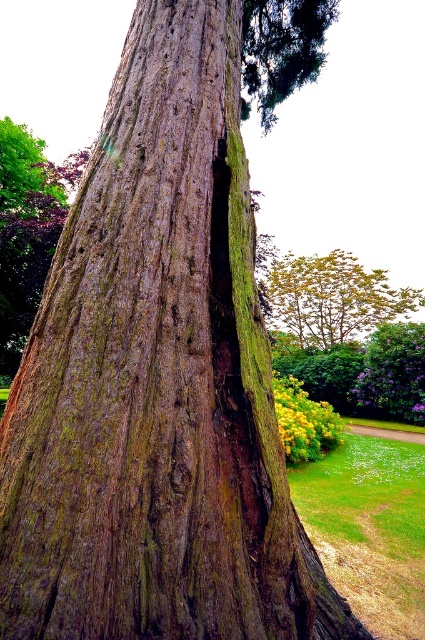
Is yellow-green textured tree trunk at upper right wider than green mossy bark at upper center?

No.

Between point (357, 298) and point (274, 113), which one is positioned in front?

Point (274, 113)

This screenshot has width=425, height=640. I want to click on yellow-green textured tree trunk at upper right, so click(x=334, y=298).

Is green mossy bark at upper center above green mossy tree trunk at center?

Yes.

Between point (302, 13) and point (424, 358), which one is positioned in front?

Point (302, 13) is in front.

I want to click on green mossy bark at upper center, so click(280, 49).

Where is `green mossy bark at upper center`? This screenshot has width=425, height=640. green mossy bark at upper center is located at coordinates (280, 49).

Does yellow-green textured tree trunk at upper right appear under green mossy tree trunk at center?

Actually, yellow-green textured tree trunk at upper right is above green mossy tree trunk at center.

Which is in front, point (323, 332) or point (370, 390)?

Point (370, 390) is in front.

The height and width of the screenshot is (640, 425). What are the coordinates of `yellow-green textured tree trunk at upper right` in the screenshot? It's located at (334, 298).